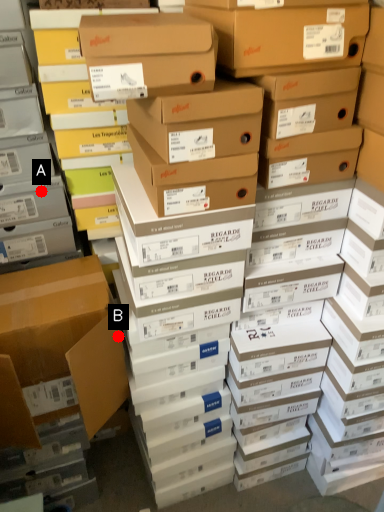
Question: Two points are circled on the image, labeled by A and B beside each circle. Which point is closer to the camera?

Choices:
 (A) A is closer
 (B) B is closer

Answer: (B)